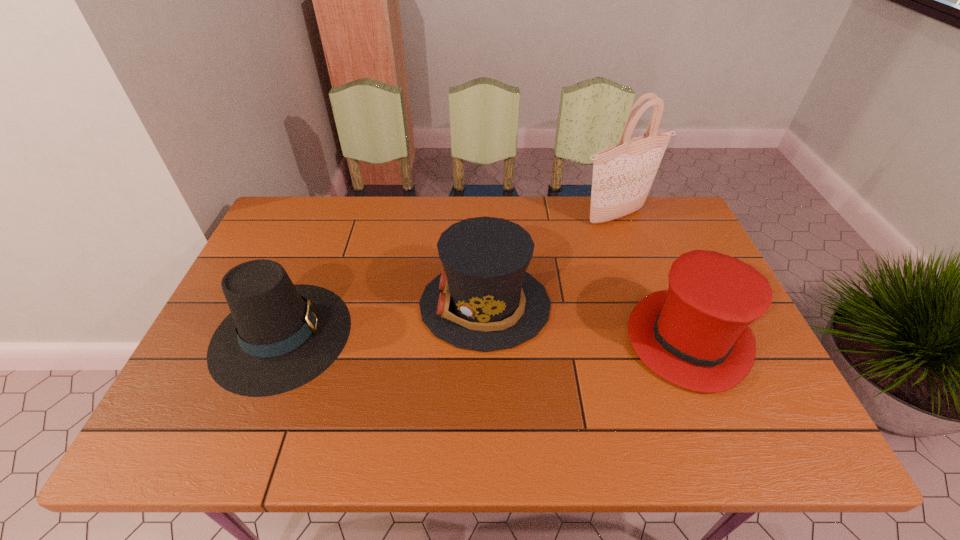
The image size is (960, 540). I want to click on vacant space at the near right corner, so (x=800, y=437).

In order to click on free space that is in between the second object from left to right and the rightmost hat in this screenshot , I will do click(587, 322).

Locate an element on the screen. The height and width of the screenshot is (540, 960). empty location between the farthest object and the rightmost hat is located at coordinates (652, 279).

The width and height of the screenshot is (960, 540). I want to click on vacant space in between the leftmost object and the second hat from left to right, so click(x=383, y=320).

Locate an element on the screen. blank region between the rightmost hat and the second hat from left to right is located at coordinates (587, 322).

Image resolution: width=960 pixels, height=540 pixels. Find the location of `free spot between the rightmost hat and the second hat from left to right`. free spot between the rightmost hat and the second hat from left to right is located at coordinates (587, 322).

Identify which object is located as the second nearest to the tallest object. Please provide its 2D coordinates. Your answer should be formatted as a tuple, i.e. [(x, y)], where the tuple contains the x and y coordinates of a point satisfying the conditions above.

[(695, 335)]

Select which object appears as the third closest to the leftmost hat. Please provide its 2D coordinates. Your answer should be formatted as a tuple, i.e. [(x, y)], where the tuple contains the x and y coordinates of a point satisfying the conditions above.

[(695, 335)]

I want to click on hat object that ranks as the second closest to the rightmost hat, so click(x=279, y=336).

This screenshot has height=540, width=960. I want to click on hat that stands as the second closest to the rightmost hat, so click(279, 336).